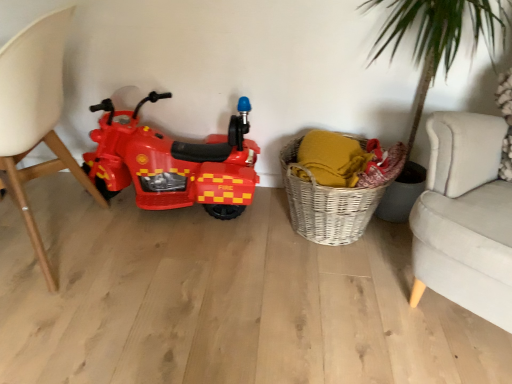
Where is `vacant point to the right of matte white chair at left`? The height and width of the screenshot is (384, 512). vacant point to the right of matte white chair at left is located at coordinates (180, 276).